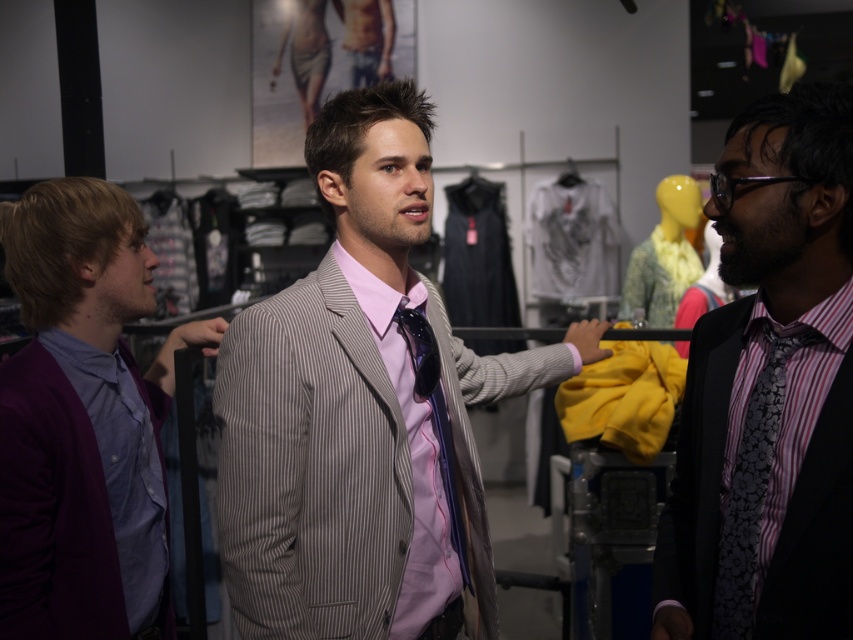
What do you see at coordinates (363, 410) in the screenshot? I see `striped fabric suit at center` at bounding box center [363, 410].

Between point (312, 337) and point (53, 317), which one is positioned behind?

Positioned behind is point (53, 317).

Identify the location of striped fabric suit at center. The image size is (853, 640). (363, 410).

Who is more forward, (514, 388) or (840, 604)?

Point (840, 604)

Can you confirm if striped fabric suit at center is bigger than black textured suit at right?

Yes, striped fabric suit at center is bigger than black textured suit at right.

Is point (276, 515) behind point (788, 289)?

Yes, it is behind point (788, 289).

The height and width of the screenshot is (640, 853). In order to click on striped fabric suit at center in this screenshot , I will do `click(363, 410)`.

Does purple cotton dress shirt at left have a lesser height compared to purple satin tie at center?

In fact, purple cotton dress shirt at left may be taller than purple satin tie at center.

Is purple cotton dress shirt at left further to camera compared to purple satin tie at center?

Yes, purple cotton dress shirt at left is behind purple satin tie at center.

Locate an element on the screen. The width and height of the screenshot is (853, 640). purple cotton dress shirt at left is located at coordinates (122, 467).